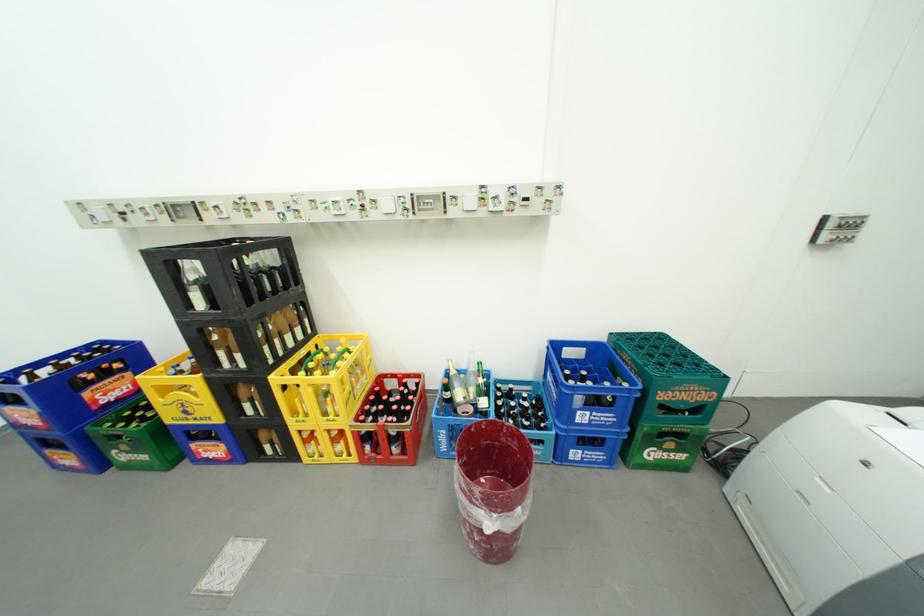
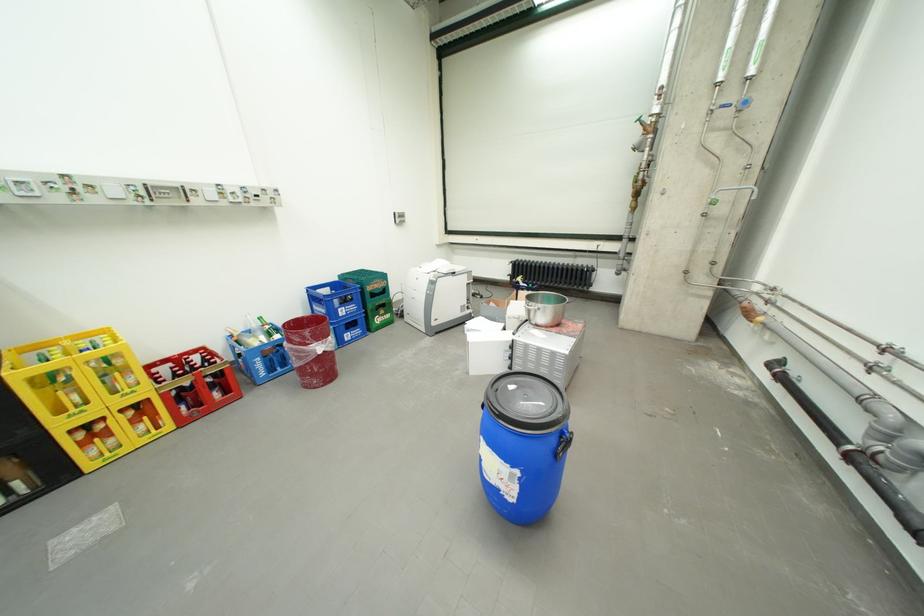
Find the pixel in the second image that matches pixel 483 431 in the first image.

(297, 328)